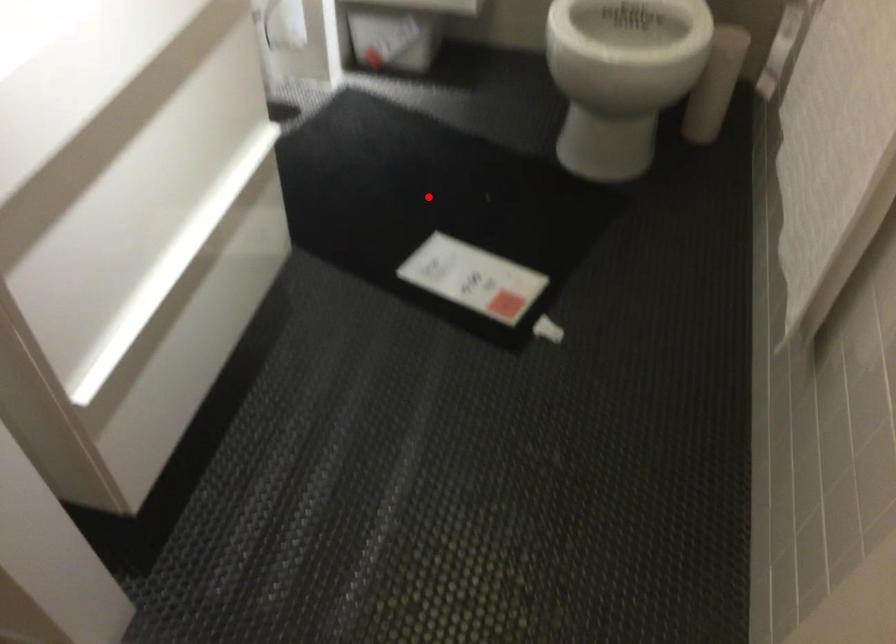
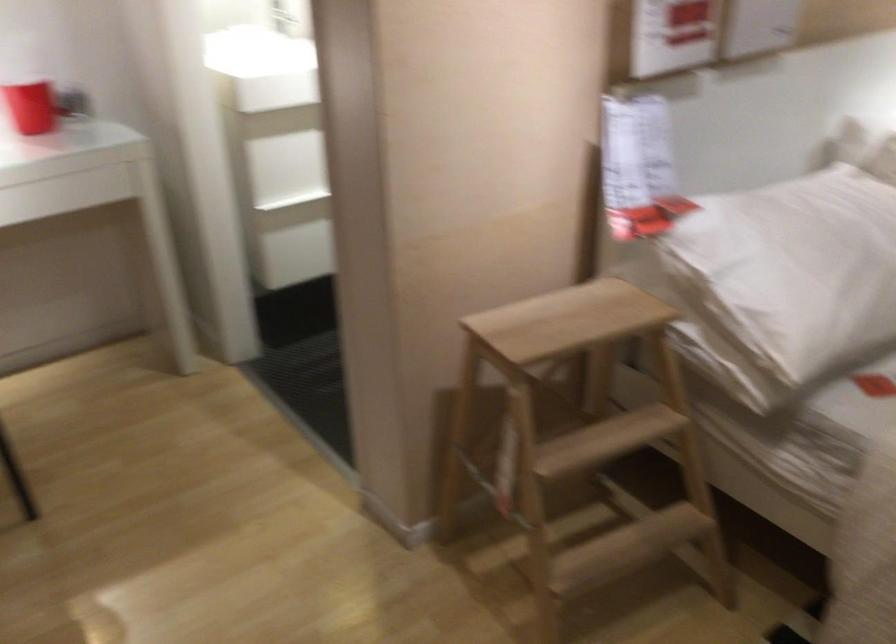
Question: I am providing you with two images of the same scene from different viewpoints. A red point is marked on the first image. Is the red point's position out of view in image 2?

Choices:
 (A) Yes
 (B) No

Answer: (A)